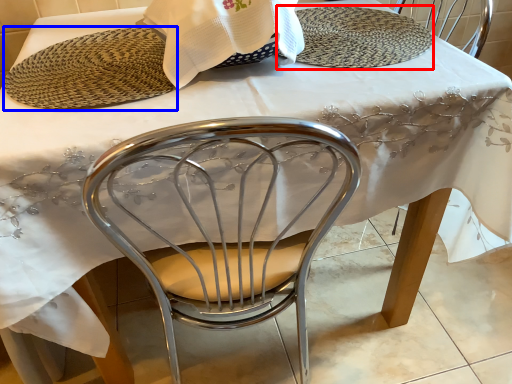
Question: Among these objects, which one is nearest to the camera, plate (highlighted by a red box) or platter (highlighted by a blue box)?

Choices:
 (A) plate
 (B) platter

Answer: (B)